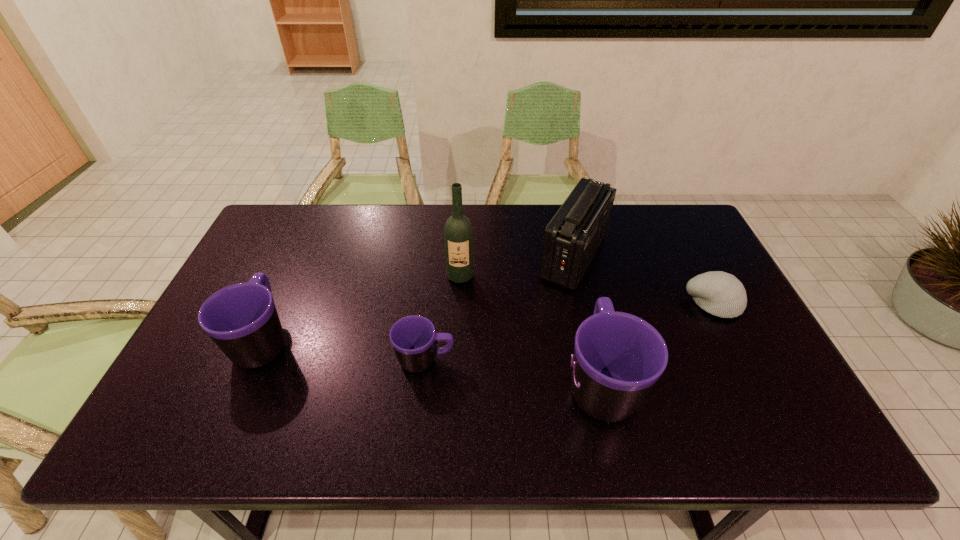
Identify the location of vacant region that satisfies the following two spatial constraints: 1. with the handle on the side of the rightmost object; 2. on the left side of the leftmost object. (280, 303).

The height and width of the screenshot is (540, 960). Find the location of `free space in the image that satisfies the following two spatial constraints: 1. on the front panel of the radio receiver; 2. on the labeled side of the wine bottle`. free space in the image that satisfies the following two spatial constraints: 1. on the front panel of the radio receiver; 2. on the labeled side of the wine bottle is located at coordinates (578, 276).

Identify the location of blank space that satisfies the following two spatial constraints: 1. with the handle on the side of the rightmost object; 2. on the right side of the rightmost mug. (583, 303).

Locate an element on the screen. free space that satisfies the following two spatial constraints: 1. with the handle on the side of the rightmost mug; 2. with the handle on the side of the shortest mug is located at coordinates (595, 361).